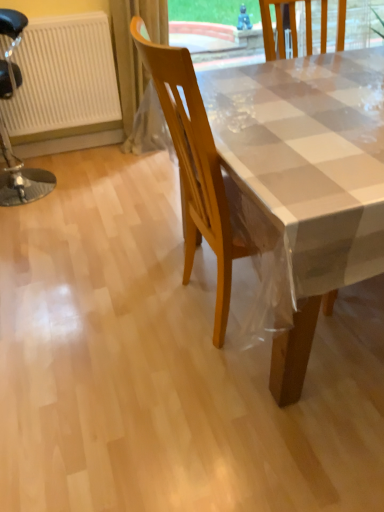
Question: Is wooden chair at center, which is counted as the second chair, starting from the back, spatially inside black leather stool at left, which is the 1th chair from left to right, or outside of it?

Choices:
 (A) inside
 (B) outside

Answer: (B)

Question: Does point (221, 265) appear closer or farther from the camera than point (9, 193)?

Choices:
 (A) closer
 (B) farther

Answer: (A)

Question: Considering the real-world distances, which object is farthest from the black leather stool at left, placed as the 2th chair when sorted from front to back?

Choices:
 (A) wooden chair at center, the second chair from the left
 (B) translucent plastic curtain at upper left
 (C) white textured radiator at left

Answer: (A)

Question: Estimate the real-world distances between objects in this image. Which object is farther from the black leather stool at left, which is the 1th chair from left to right?

Choices:
 (A) wooden chair at center, the first chair from the right
 (B) white textured radiator at left
 (C) translucent plastic curtain at upper left

Answer: (A)